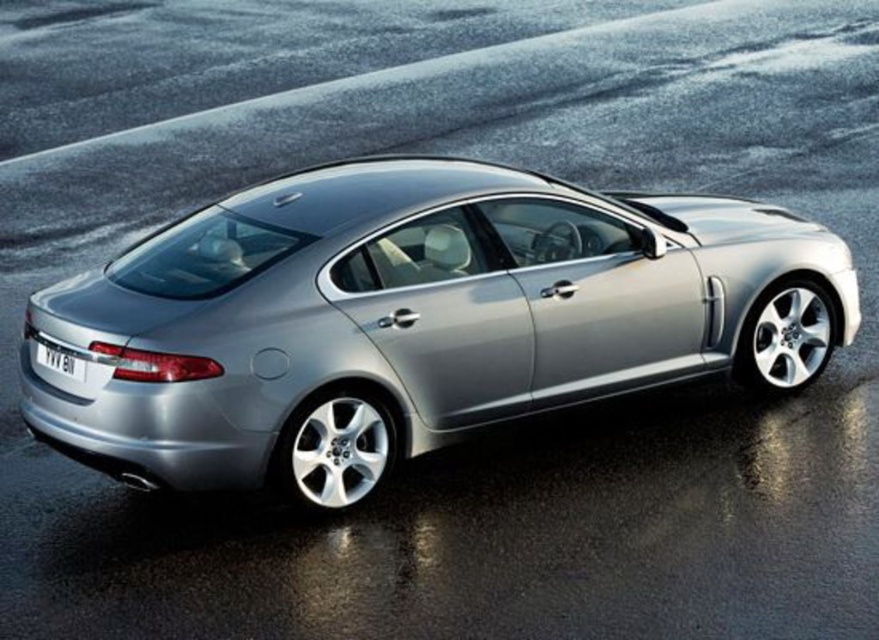
Does satin silver car at center appear on the right side of black plastic license plate at lower center?

Correct, you'll find satin silver car at center to the right of black plastic license plate at lower center.

Can you confirm if satin silver car at center is smaller than black plastic license plate at lower center?

Incorrect, satin silver car at center is not smaller in size than black plastic license plate at lower center.

What do you see at coordinates (413, 321) in the screenshot? I see `satin silver car at center` at bounding box center [413, 321].

Locate an element on the screen. The height and width of the screenshot is (640, 879). satin silver car at center is located at coordinates (413, 321).